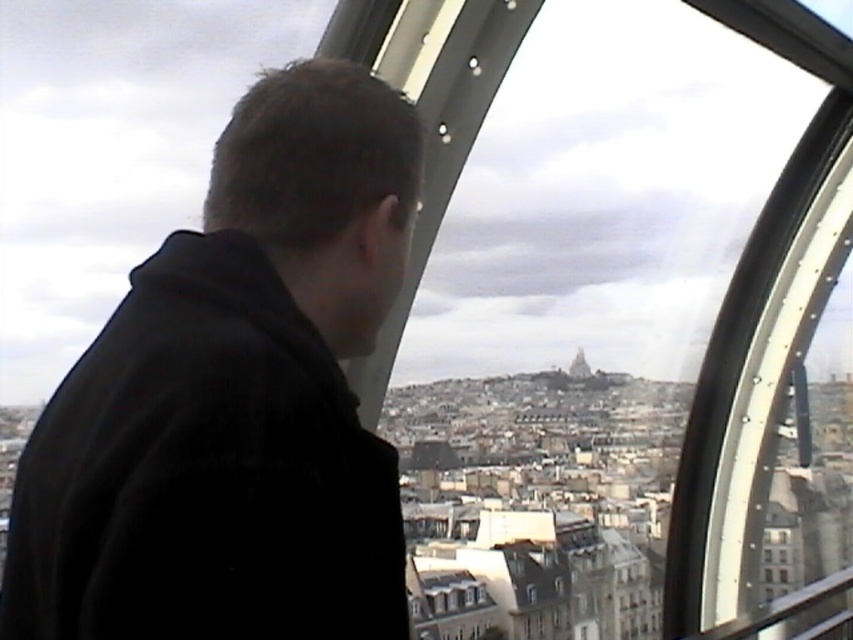
Between point (165, 237) and point (535, 595), which one is positioned behind?

The point (165, 237) is behind.

Locate an element on the screen. This screenshot has width=853, height=640. black matte jacket at left is located at coordinates (236, 397).

In order to click on black matte jacket at left in this screenshot , I will do `click(236, 397)`.

Who is positioned more to the right, black matte jacket at left or smooth stone tower at center?

smooth stone tower at center is more to the right.

Does black matte jacket at left have a lesser height compared to smooth stone tower at center?

No, black matte jacket at left is not shorter than smooth stone tower at center.

Find the location of a particular element. black matte jacket at left is located at coordinates (236, 397).

You are a GUI agent. You are given a task and a screenshot of the screen. Output one action in this format:
    pyautogui.click(x=<x>, y=<y>)
    Task: Click on the black matte jacket at left
    This screenshot has width=853, height=640.
    Given the screenshot: What is the action you would take?
    pyautogui.click(x=236, y=397)

Who is higher up, smooth stone tower at center or transparent glass window at center?

Positioned higher is smooth stone tower at center.

Which is in front, point (578, 353) or point (537, 592)?

Point (537, 592) is in front.

Identify the location of smooth stone tower at center. (579, 365).